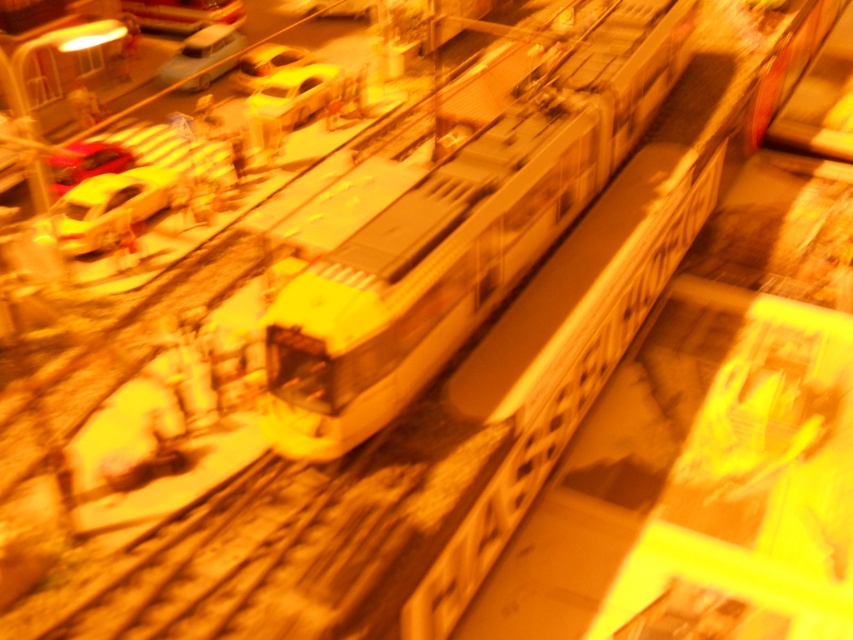
Between white glossy train at center and shiny yellow car at upper center, which one has less height?

With less height is shiny yellow car at upper center.

Who is more distant from viewer, (389,381) or (274,61)?

The point (274,61) is behind.

Is point (310, 426) more distant than point (256, 68)?

No, it is in front of (256, 68).

I want to click on white glossy train at center, so click(460, 237).

Can you confirm if white glossy train at center is positioned to the left of matte plastic car at upper left?

Incorrect, white glossy train at center is not on the left side of matte plastic car at upper left.

In the scene shown: Who is higher up, white glossy train at center or matte plastic car at upper left?

matte plastic car at upper left is above.

Identify the location of white glossy train at center. (460, 237).

Does yellow matte car at left have a larger size compared to matte plastic car at upper left?

Yes, yellow matte car at left is bigger than matte plastic car at upper left.

Which is above, yellow matte car at left or matte plastic car at upper left?

matte plastic car at upper left

Who is more distant from viewer, (90, 180) or (216, 56)?

The point (216, 56) is behind.

The image size is (853, 640). What are the coordinates of `yellow matte car at left` in the screenshot? It's located at (109, 208).